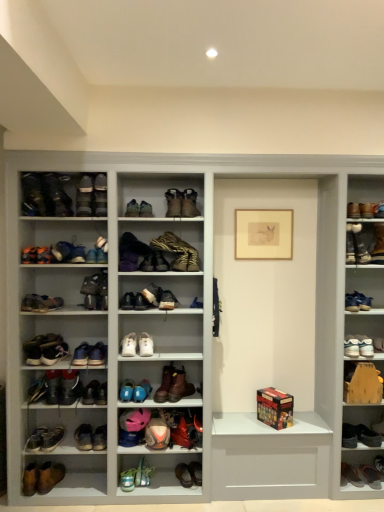
The image size is (384, 512). In order to click on free spot to the left of brown leather boot at lower right, positioned as the 25th footwear in left-to-right order in this screenshot , I will do `click(344, 482)`.